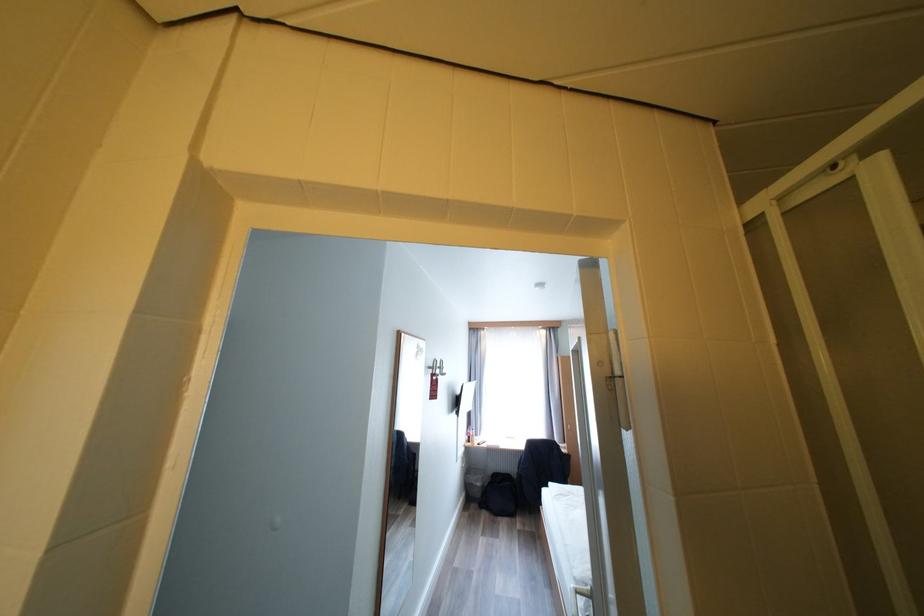
Which object does [469,435] point to?

It refers to a small clear bottle.